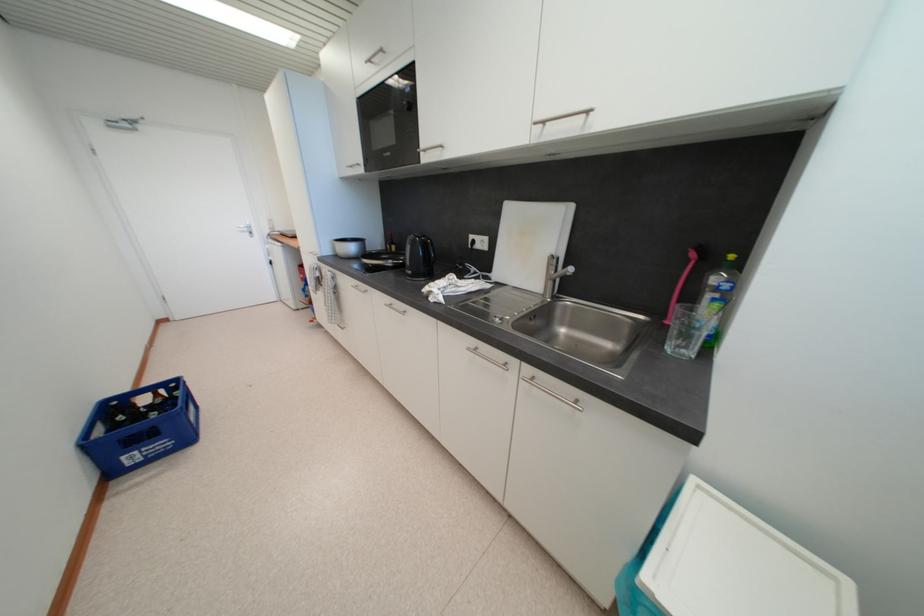
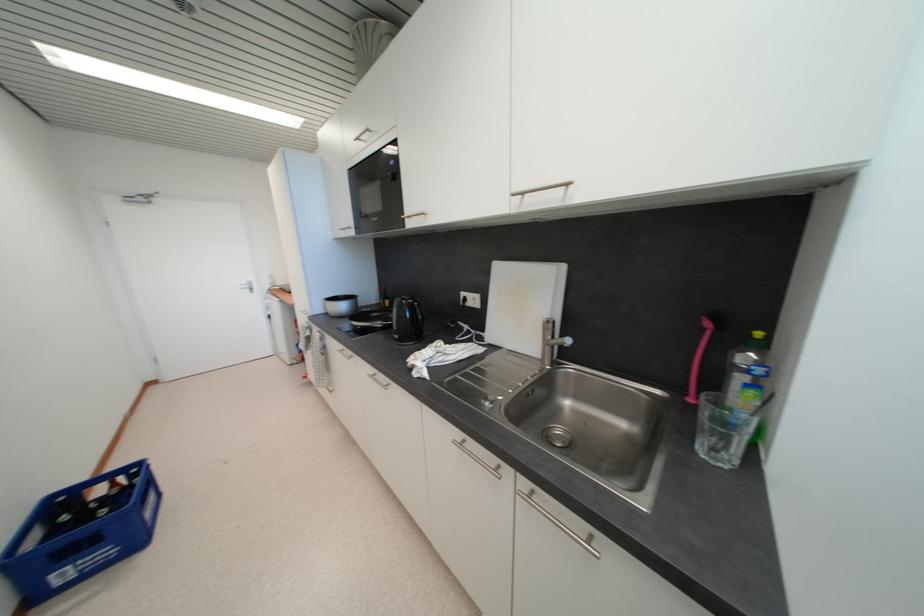
The point at [391,307] is marked in the first image. Where is the corresponding point in the second image?

(373, 378)